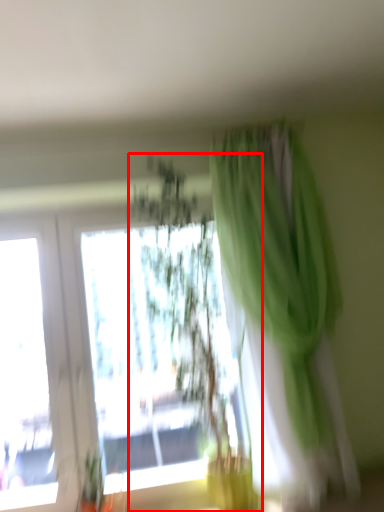
Question: From the image's perspective, what is the correct spatial positioning of houseplant (annotated by the red box) in reference to curtain?

Choices:
 (A) above
 (B) below

Answer: (B)